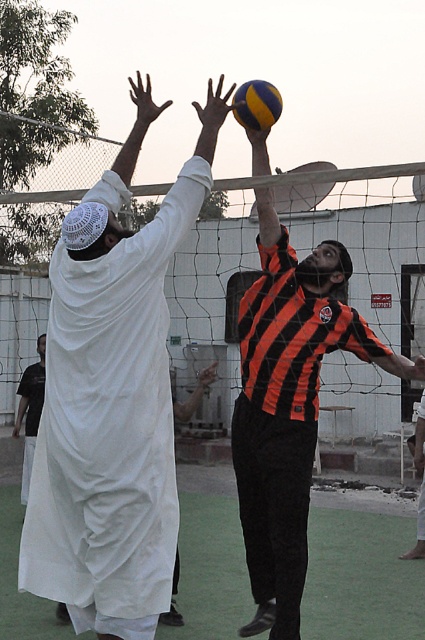
From the picture: Based on the scene described, which object is larger between the white clothed person at upper left and the white cloth at upper left?

The white clothed person at upper left is bigger than the white cloth at upper left according to the description.

What are the coordinates of the white clothed person at upper left in the image?

The white clothed person at upper left is located at coordinates point (113,400).